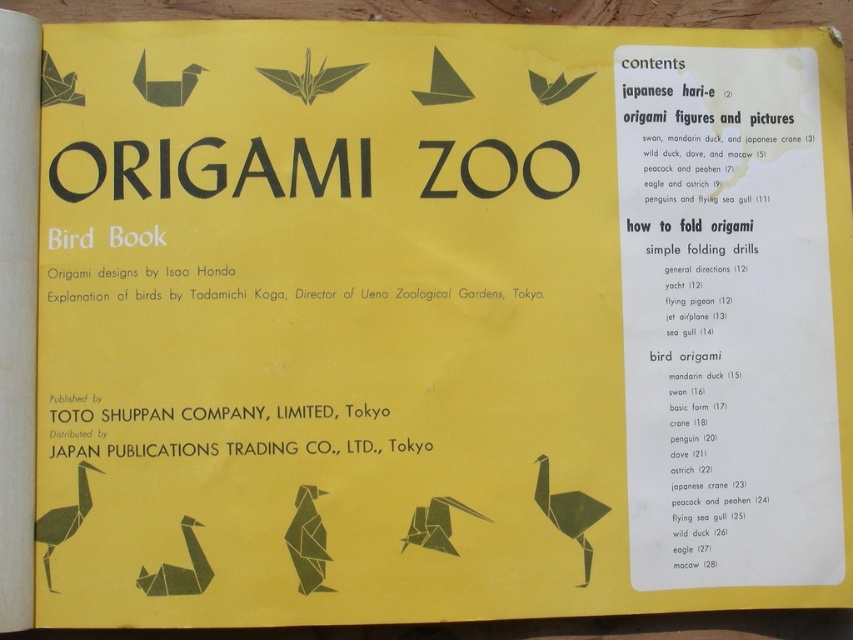
Can you confirm if matte black ostrich at center is thinner than green paper crane at lower left?

In fact, matte black ostrich at center might be wider than green paper crane at lower left.

Who is more distant from viewer, (x=598, y=500) or (x=59, y=508)?

The point (x=598, y=500) is behind.

Between point (584, 544) and point (44, 536), which one is positioned in front?

Point (44, 536)

Locate an element on the screen. The height and width of the screenshot is (640, 853). matte black ostrich at center is located at coordinates (567, 513).

Is green paper bird at center above green paper crane at lower left?

No.

Is the position of green paper bird at center less distant than that of green paper crane at lower left?

That is False.

Does point (312, 540) come closer to viewer compared to point (76, 524)?

No, it is not.

The width and height of the screenshot is (853, 640). I want to click on green paper bird at center, so click(306, 541).

Between green paper bird at center and matte green origami bird at center, which one is positioned higher?

matte green origami bird at center

Who is more distant from viewer, (303, 582) or (421, 508)?

The point (421, 508) is behind.

Who is more forward, [306,486] or [454,552]?

Positioned in front is point [306,486].

Locate an element on the screen. green paper bird at center is located at coordinates 306,541.